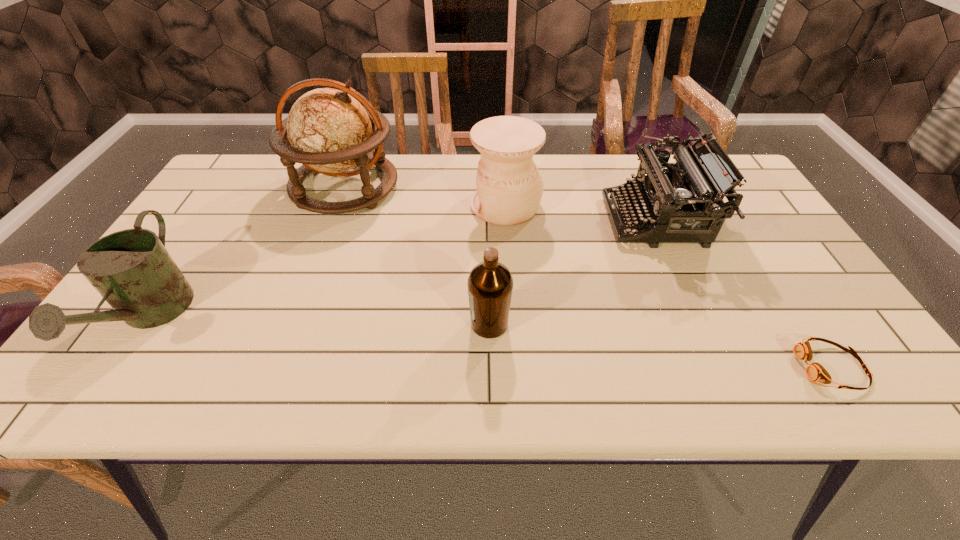
At what (x,y) coordinates should I click in order to perform the action: click on vacant space located with the lenses facing forward on the rightmost object. Please return your answer as a coordinate pair (x, y). The image size is (960, 540). Looking at the image, I should click on (749, 367).

At what (x,y) coordinates should I click in order to perform the action: click on globe that is positioned at the far edge. Please return your answer as a coordinate pair (x, y). Looking at the image, I should click on (329, 131).

Identify the location of pottery at the far edge. (509, 185).

I want to click on typewriter that is at the far edge, so click(661, 194).

Find the location of a particular element. The width and height of the screenshot is (960, 540). watering can present at the near edge is located at coordinates pyautogui.click(x=131, y=269).

Find the location of `goggles at the near edge`. goggles at the near edge is located at coordinates (815, 372).

This screenshot has width=960, height=540. What are the coordinates of `object positioned at the left edge` in the screenshot? It's located at (131, 269).

Locate an element on the screen. object situated at the right edge is located at coordinates (x=815, y=372).

Find the location of a particular element. Image resolution: width=960 pixels, height=540 pixels. object that is at the near left corner is located at coordinates (131, 269).

Image resolution: width=960 pixels, height=540 pixels. What are the coordinates of `object that is at the near right corner` in the screenshot? It's located at (x=815, y=372).